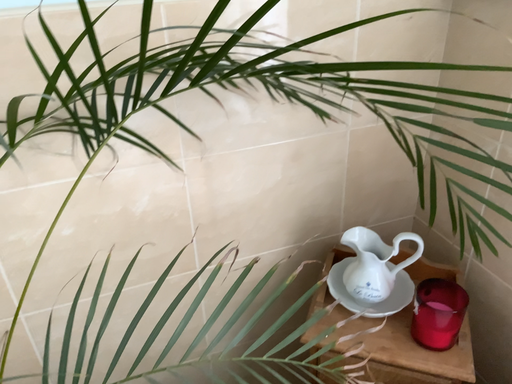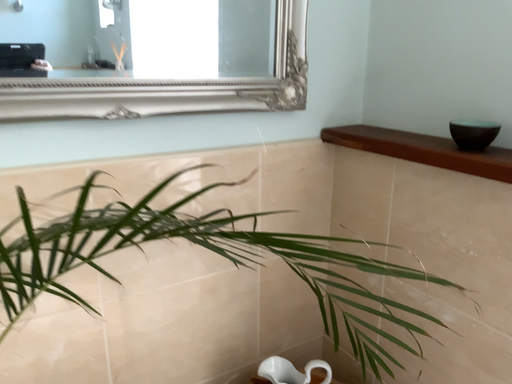
Question: Which way did the camera rotate in the video?

Choices:
 (A) rotated downward
 (B) rotated upward

Answer: (B)